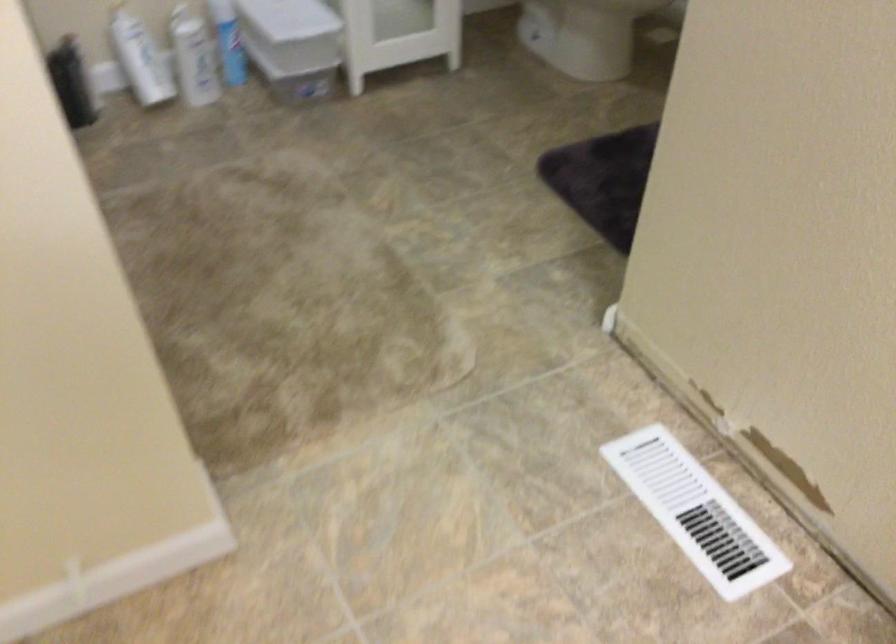
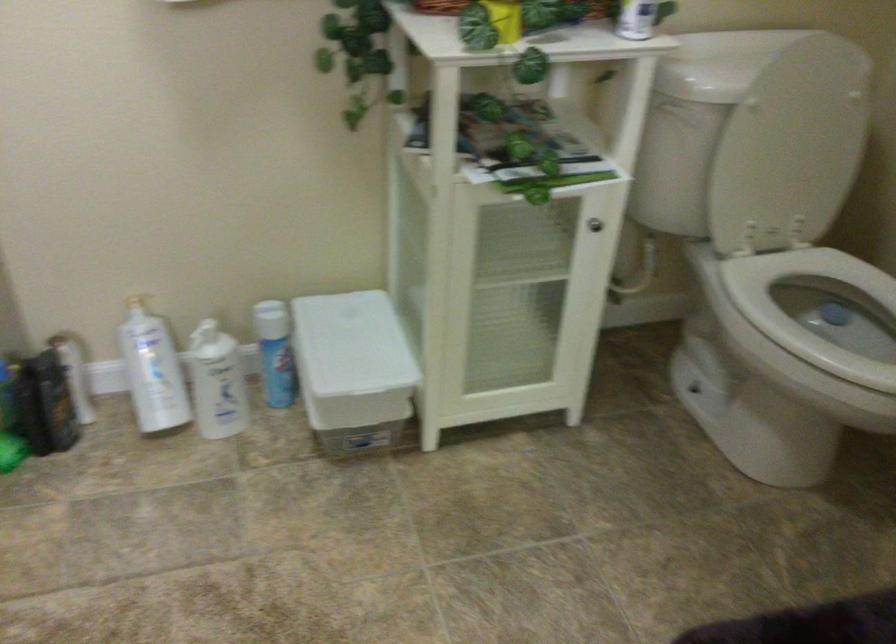
Question: The images are taken continuously from a first-person perspective. In which direction are you moving?

Choices:
 (A) Left
 (B) Right
 (C) Forward
 (D) Backward

Answer: (C)